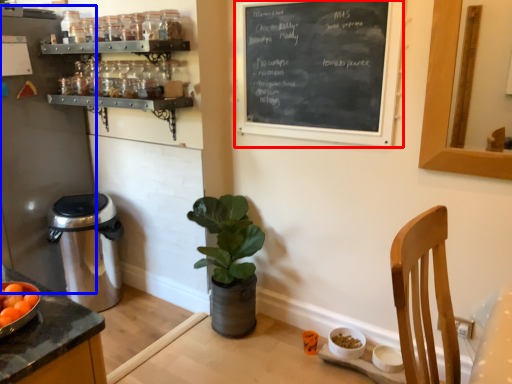
Question: Among these objects, which one is farthest to the camera, bulletin board (highlighted by a red box) or appliance (highlighted by a blue box)?

Choices:
 (A) bulletin board
 (B) appliance

Answer: (B)